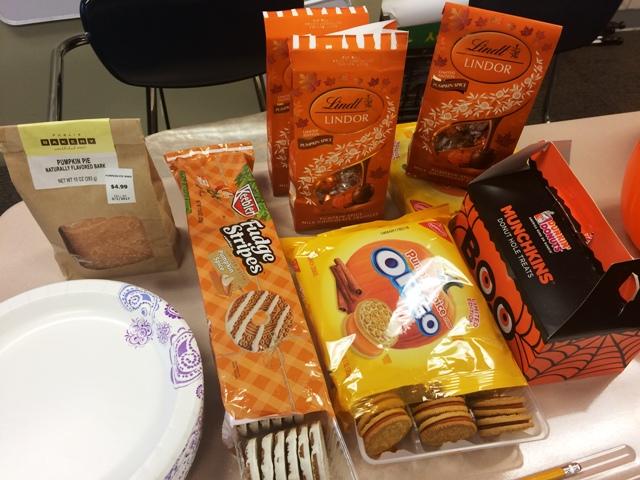
You are a GUI agent. You are given a task and a screenshot of the screen. Output one action in this format:
    pyautogui.click(x=<x>, y=<y>)
    Task: Click on the table
    Image resolution: width=640 pixels, height=480 pixels.
    Given the screenshot: What is the action you would take?
    pyautogui.click(x=27, y=263)